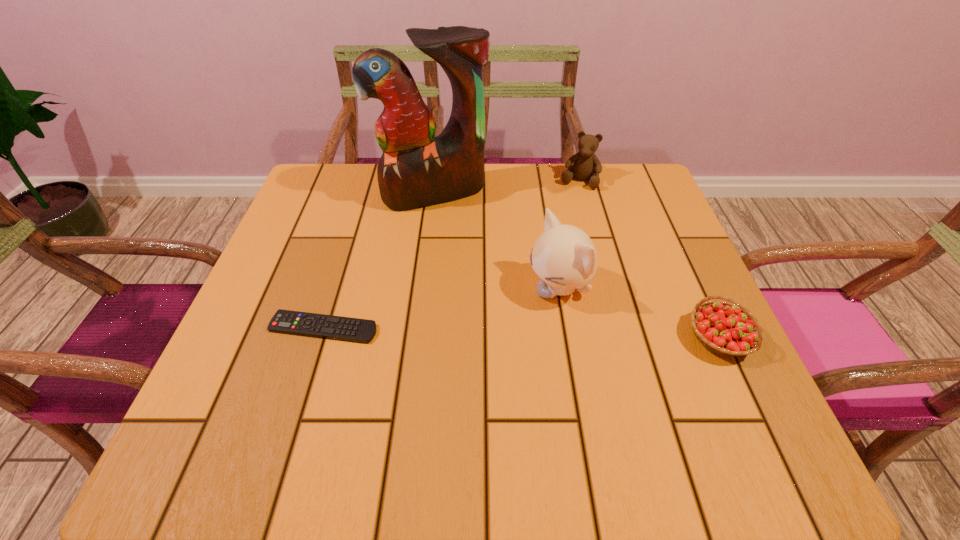
The width and height of the screenshot is (960, 540). Identify the location of vacant space situated on the front-facing side of the teddy bear. (554, 252).

Where is `free space located 0.170m on the face of the kitten`? free space located 0.170m on the face of the kitten is located at coordinates (459, 335).

What are the coordinates of `vacant space located 0.290m on the face of the kitten` in the screenshot? It's located at (400, 363).

This screenshot has height=540, width=960. In order to click on free spot located on the face of the kitten in this screenshot , I will do `click(487, 322)`.

The width and height of the screenshot is (960, 540). I want to click on vacant space located 0.260m at the face of the tallest object, so click(479, 285).

At what (x,y) coordinates should I click in order to perform the action: click on vacant region located 0.160m at the face of the tallest object. Please return your answer as a coordinate pair (x, y). This screenshot has width=960, height=540. Looking at the image, I should click on (466, 254).

In order to click on blank area located at the face of the tallest object in this screenshot , I will do `click(472, 269)`.

This screenshot has width=960, height=540. I want to click on teddy bear located at the far edge, so click(586, 165).

This screenshot has height=540, width=960. What are the coordinates of `parrot located in the far edge section of the desktop` in the screenshot? It's located at (417, 169).

Locate an element on the screen. The image size is (960, 540). object situated at the near edge is located at coordinates (729, 329).